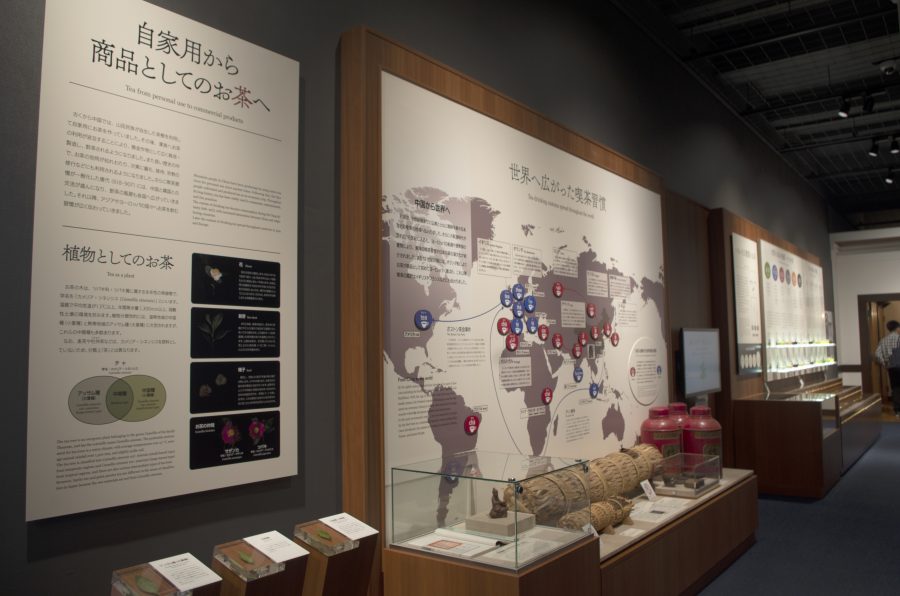
The width and height of the screenshot is (900, 596). Identify the location of floor. (807, 566), (848, 504), (885, 458).